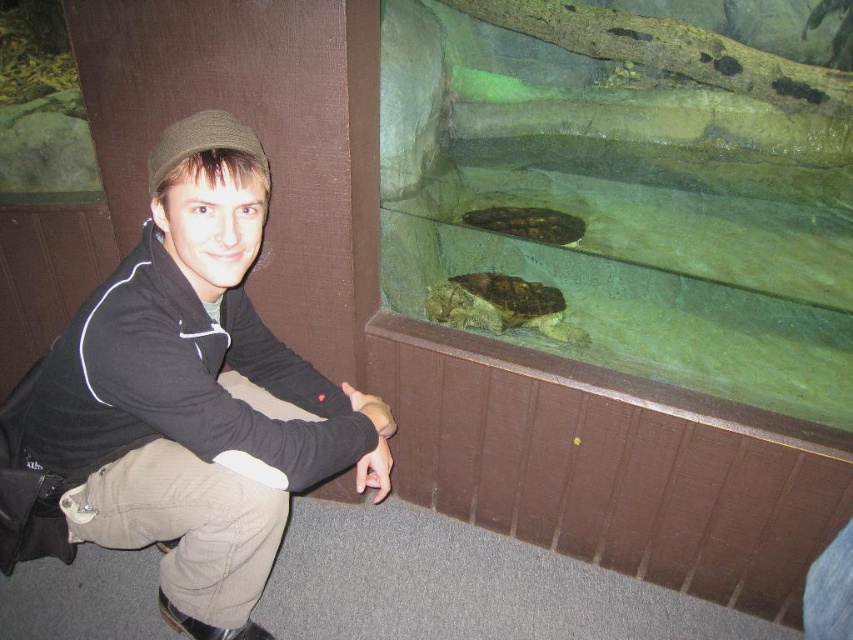
Which is above, black matte jacket at lower left or brown matte turtle at upper center?

brown matte turtle at upper center is higher up.

Which is behind, point (306, 396) or point (483, 209)?

Positioned behind is point (483, 209).

Where is `black matte jacket at lower left`? This screenshot has height=640, width=853. black matte jacket at lower left is located at coordinates (195, 394).

Is black matte jacket at lower left above brown scaly turtle at center?

No, black matte jacket at lower left is not above brown scaly turtle at center.

Which is more to the left, black matte jacket at lower left or brown scaly turtle at center?

From the viewer's perspective, black matte jacket at lower left appears more on the left side.

Who is more forward, (383, 490) or (543, 301)?

Point (383, 490) is more forward.

Identify the location of black matte jacket at lower left. (195, 394).

Is brown scaly turtle at center bigger than brown matte turtle at upper center?

Yes.

Between point (560, 307) and point (577, 225), which one is positioned behind?

The point (577, 225) is behind.

Locate an element on the screen. This screenshot has height=640, width=853. brown scaly turtle at center is located at coordinates (502, 305).